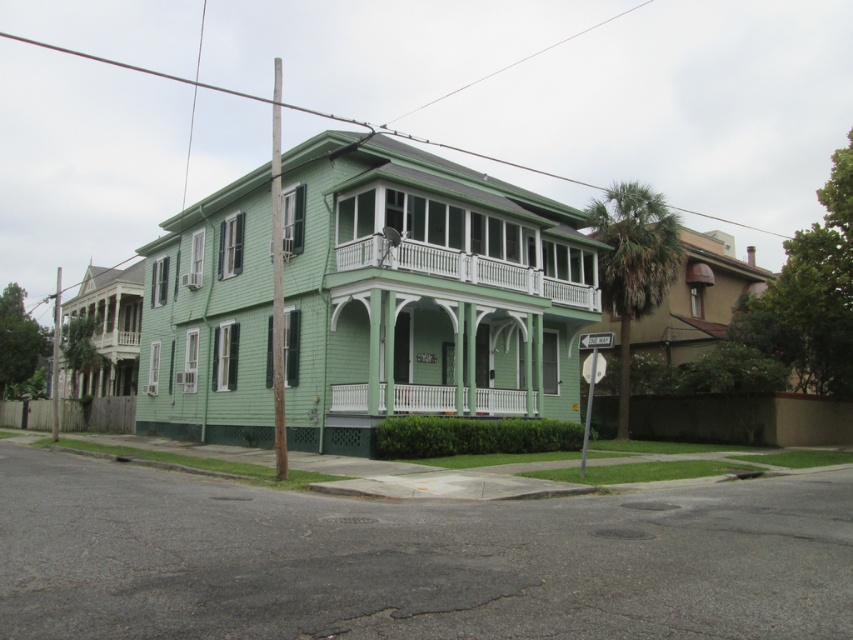
Question: Does white wooden porch at upper center appear over white painted wood porch at center?

Choices:
 (A) yes
 (B) no

Answer: (A)

Question: Among these points, which one is nearest to the camera?

Choices:
 (A) (430, 250)
 (B) (422, 388)

Answer: (B)

Question: Does white wooden porch at upper center have a greater width compared to white painted wood porch at center?

Choices:
 (A) no
 (B) yes

Answer: (B)

Question: Does white wooden porch at upper center have a greater width compared to white painted wood porch at center?

Choices:
 (A) no
 (B) yes

Answer: (B)

Question: Which point is closer to the camera?

Choices:
 (A) white wooden porch at upper center
 (B) white painted wood porch at center

Answer: (A)